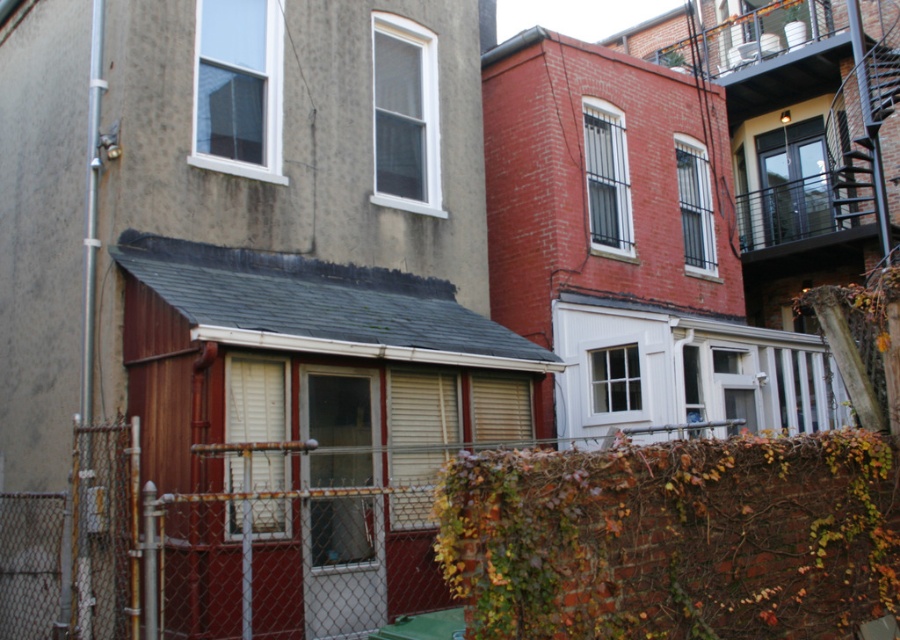
Which is above, rusty chain-link fence at lower center or black metal fire escape at upper right?

black metal fire escape at upper right

Is point (171, 636) in front of point (768, 228)?

Yes, point (171, 636) is in front of point (768, 228).

Where is `rusty chain-link fence at lower center`? rusty chain-link fence at lower center is located at coordinates (198, 554).